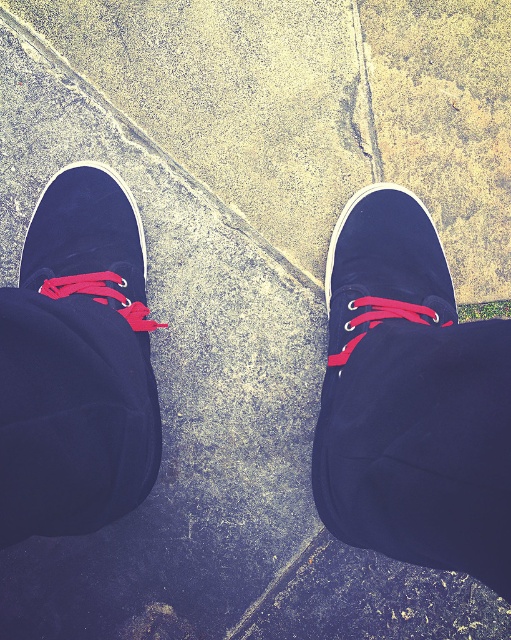
Question: Which point appears farthest from the camera in this image?

Choices:
 (A) (434, 364)
 (B) (22, 417)

Answer: (A)

Question: Which object appears farthest from the camera in this image?

Choices:
 (A) suede-like navy blue shoe at center
 (B) suede blue shoe at left

Answer: (B)

Question: Can you confirm if suede-like navy blue shoe at center is wider than suede blue shoe at left?

Choices:
 (A) no
 (B) yes

Answer: (A)

Question: Is suede-like navy blue shoe at center to the right of suede blue shoe at left from the viewer's perspective?

Choices:
 (A) yes
 (B) no

Answer: (A)

Question: Does suede-like navy blue shoe at center have a smaller size compared to suede blue shoe at left?

Choices:
 (A) yes
 (B) no

Answer: (B)